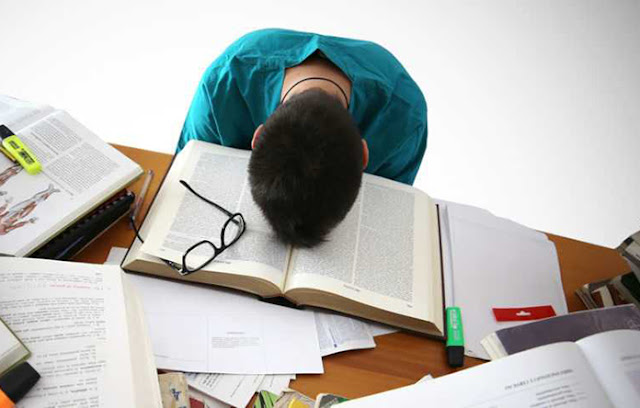
Where is `book pages`? The image size is (640, 408). book pages is located at coordinates (618, 370), (545, 391), (362, 267), (257, 264), (97, 331), (59, 181), (8, 113).